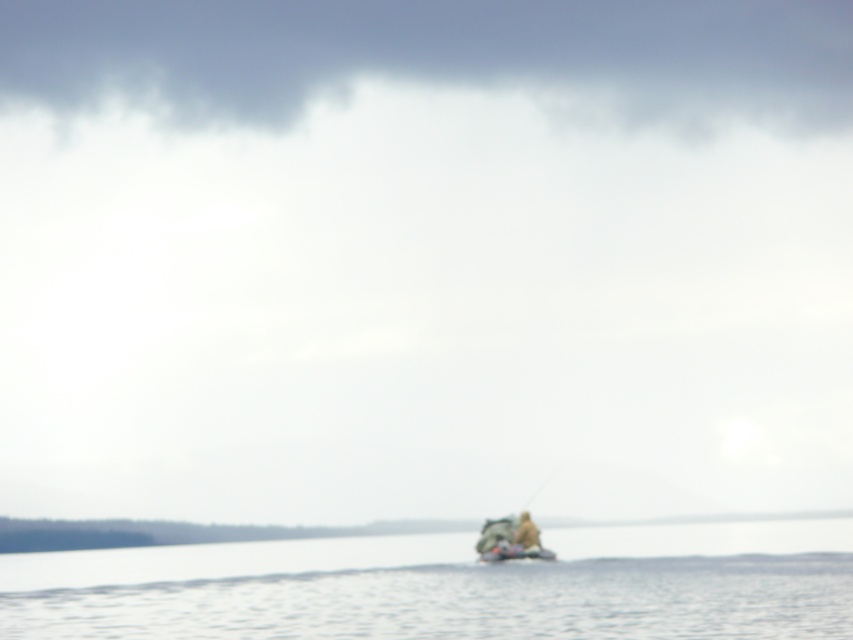
You are standing on the shore and looking at the camouflage fabric canoe at center and the brown fabric person at center. Which object is closer to you?

The camouflage fabric canoe at center is closer to the viewer than the brown fabric person at center, so the camouflage fabric canoe at center is closer to you.